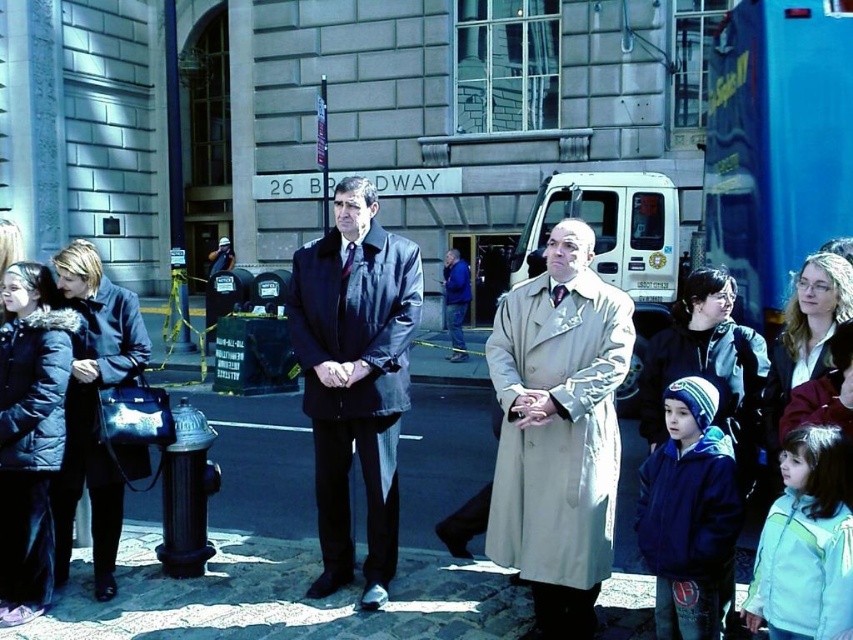
You are a tailor measuring coats for alterations. You need to determine which coat requires a wider table to lay out flat without folding. Which one is wider between the dark brown leather jacket at center and the velvet black coat at left?

The dark brown leather jacket at center is wider than the velvet black coat at left, so the dark brown leather jacket at center requires a wider table to lay out flat without folding.

You are a photographer trying to capture both the beige leather trench coat at center and the dark brown leather jacket at center in a single frame. Based on their positions, which one should you adjust your camera angle to focus on first to ensure both are in the shot?

Since the beige leather trench coat at center is to the right of the dark brown leather jacket at center, you should adjust your camera angle to focus on the dark brown leather jacket at center first to include both in the frame.